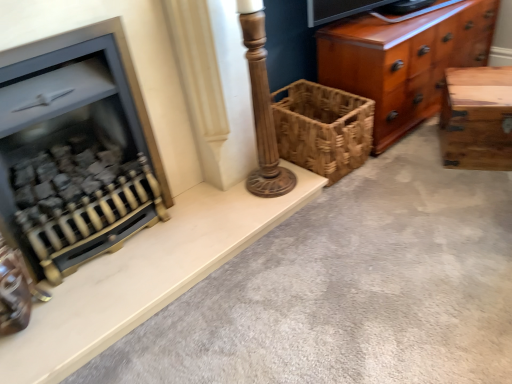
Where is `free space above white marble fireplace at left (from a real-world perspective)`? The image size is (512, 384). free space above white marble fireplace at left (from a real-world perspective) is located at coordinates (157, 243).